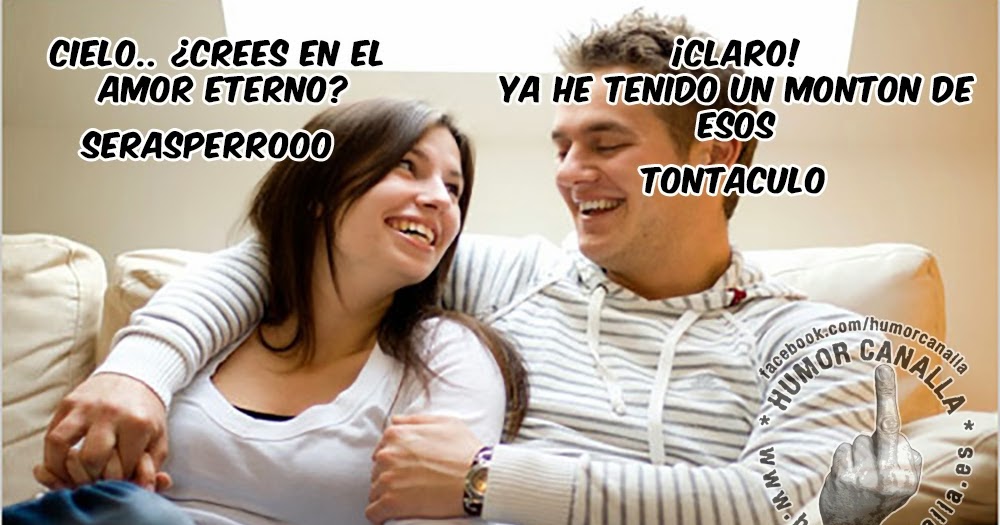
Find the location of a particular element. This screenshot has height=525, width=1000. pillows is located at coordinates (66, 289), (137, 280), (887, 275), (941, 441).